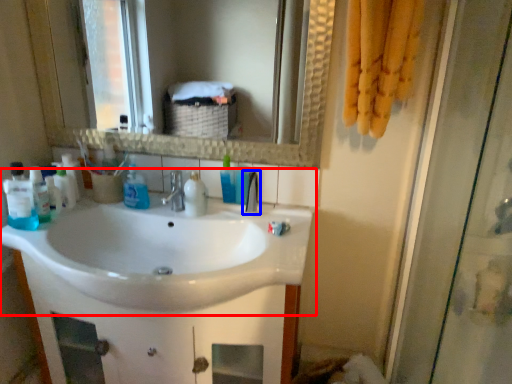
Question: Which of the following is the closest to the observer, sink (highlighted by a red box) or tap (highlighted by a blue box)?

Choices:
 (A) sink
 (B) tap

Answer: (A)